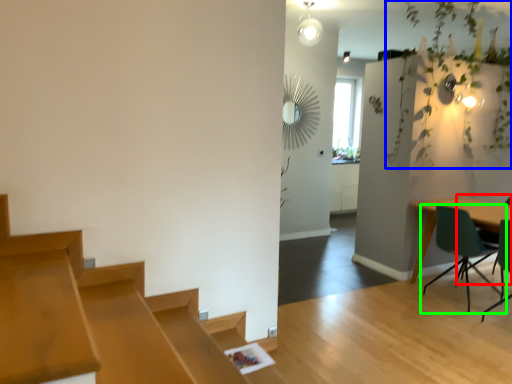
Question: Considering the real-world distances, which object is closest to armchair (highlighted by a red box)? vegetation (highlighted by a blue box) or chair (highlighted by a green box).

Choices:
 (A) vegetation
 (B) chair

Answer: (B)